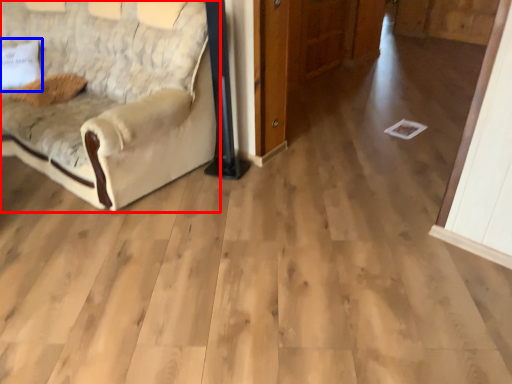
Question: Which object appears farthest to the camera in this image, studio couch (highlighted by a red box) or pillow (highlighted by a blue box)?

Choices:
 (A) studio couch
 (B) pillow

Answer: (B)